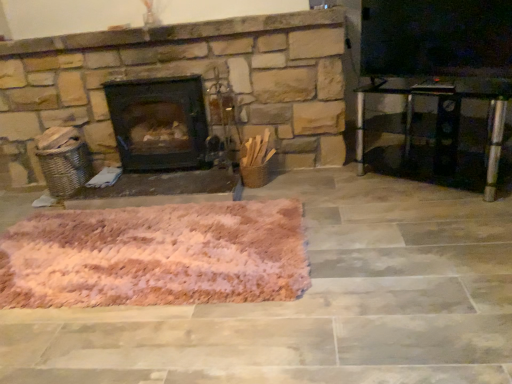
What do you see at coordinates (456, 101) in the screenshot? The image size is (512, 384). I see `transparent glass table at right` at bounding box center [456, 101].

You are a GUI agent. You are given a task and a screenshot of the screen. Output one action in this format:
    pyautogui.click(x=<x>, y=<y>)
    Task: Click on the transparent glass table at right
    This screenshot has width=512, height=384.
    Given the screenshot: What is the action you would take?
    pyautogui.click(x=456, y=101)

Is pink fluffy rug at center in front of or behind transparent glass table at right in the image?

pink fluffy rug at center is in front of transparent glass table at right.

Considering the points (58, 256) and (358, 145), which point is in front, point (58, 256) or point (358, 145)?

The point (58, 256) is more forward.

Can you confirm if pink fluffy rug at center is positioned to the right of transparent glass table at right?

In fact, pink fluffy rug at center is to the left of transparent glass table at right.

In the scene shown: Which object is closer to the camera taking this photo, transparent glass table at right or black matte wood burning stove at center?

transparent glass table at right is closer to the camera.

Is transparent glass table at right not inside black matte wood burning stove at center?

Yes.

Looking at this image, is transparent glass table at right wider or thinner than black matte wood burning stove at center?

transparent glass table at right is thinner than black matte wood burning stove at center.

Is transparent glass table at right at the left side of black matte wood burning stove at center?

No, transparent glass table at right is not to the left of black matte wood burning stove at center.

Is black matte wood burning stove at center wider than pink fluffy rug at center?

No, black matte wood burning stove at center is not wider than pink fluffy rug at center.

Considering the points (121, 140) and (65, 248), which point is behind, point (121, 140) or point (65, 248)?

Positioned behind is point (121, 140).

Is black matte wood burning stove at center closer to camera compared to pink fluffy rug at center?

That is False.

Is there a large distance between black matte wood burning stove at center and pink fluffy rug at center?

black matte wood burning stove at center is near pink fluffy rug at center, not far away.

Considering the positions of objects black matte wood burning stove at center and transparent glass table at right in the image provided, who is in front, black matte wood burning stove at center or transparent glass table at right?

transparent glass table at right is more forward.

From a real-world perspective, who is located higher, black matte wood burning stove at center or transparent glass table at right?

In real-world perspective, black matte wood burning stove at center is above.

From their relative heights in the image, would you say black matte wood burning stove at center is taller or shorter than transparent glass table at right?

Clearly, black matte wood burning stove at center is taller compared to transparent glass table at right.

Considering the relative sizes of black matte wood burning stove at center and transparent glass table at right in the image provided, is black matte wood burning stove at center wider than transparent glass table at right?

Indeed, black matte wood burning stove at center has a greater width compared to transparent glass table at right.

Are pink fluffy rug at center and black matte wood burning stove at center making contact?

pink fluffy rug at center and black matte wood burning stove at center are clearly separated.

Locate an element on the screen. This screenshot has width=512, height=384. wood burning stove behind the pink fluffy rug at center is located at coordinates (158, 123).

What's the angular difference between pink fluffy rug at center and black matte wood burning stove at center's facing directions?

2.32 degrees separate the facing orientations of pink fluffy rug at center and black matte wood burning stove at center.

From a real-world perspective, does pink fluffy rug at center sit lower than black matte wood burning stove at center?

Yes.

What's the angular difference between transparent glass table at right and pink fluffy rug at center's facing directions?

The angular difference between transparent glass table at right and pink fluffy rug at center is 36.5 degrees.

Who is smaller, transparent glass table at right or pink fluffy rug at center?

transparent glass table at right.

From the image's perspective, is transparent glass table at right above or below pink fluffy rug at center?

transparent glass table at right is above pink fluffy rug at center.

At what (x,y) coordinates should I click in order to perform the action: click on mat that appears in front of the transparent glass table at right. Please return your answer as a coordinate pair (x, y). Image resolution: width=512 pixels, height=384 pixels. Looking at the image, I should click on (156, 255).

Identify the location of mat below the transparent glass table at right (from a real-world perspective). Image resolution: width=512 pixels, height=384 pixels. (156, 255).

Identify the location of wood burning stove above the transparent glass table at right (from a real-world perspective). The width and height of the screenshot is (512, 384). (158, 123).

From the image, which object appears to be farther from pink fluffy rug at center, black matte wood burning stove at center or transparent glass table at right?

Among the two, transparent glass table at right is located further to pink fluffy rug at center.

Consider the image. From the image, which object appears to be nearer to pink fluffy rug at center, transparent glass table at right or black matte wood burning stove at center?

black matte wood burning stove at center is positioned closer to the anchor pink fluffy rug at center.

Consider the image. Based on their spatial positions, is transparent glass table at right or pink fluffy rug at center closer to black matte wood burning stove at center?

Based on the image, pink fluffy rug at center appears to be nearer to black matte wood burning stove at center.

Which object lies nearer to the anchor point black matte wood burning stove at center, pink fluffy rug at center or transparent glass table at right?

Among the two, pink fluffy rug at center is located nearer to black matte wood burning stove at center.

Looking at the image, which one is located further to transparent glass table at right, black matte wood burning stove at center or pink fluffy rug at center?

pink fluffy rug at center.

Based on their spatial positions, is pink fluffy rug at center or black matte wood burning stove at center further from transparent glass table at right?

Among the two, pink fluffy rug at center is located further to transparent glass table at right.

At what (x,y) coordinates should I click in order to perform the action: click on mat between black matte wood burning stove at center and transparent glass table at right from left to right. Please return your answer as a coordinate pair (x, y). The height and width of the screenshot is (384, 512). Looking at the image, I should click on (156, 255).